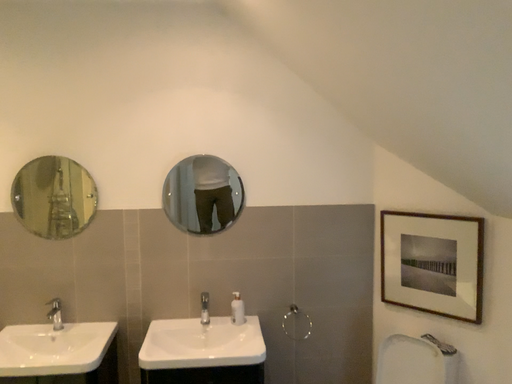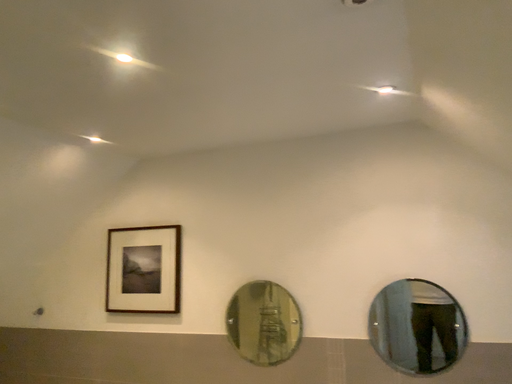
Question: Which way did the camera rotate in the video?

Choices:
 (A) rotated right
 (B) rotated left

Answer: (B)